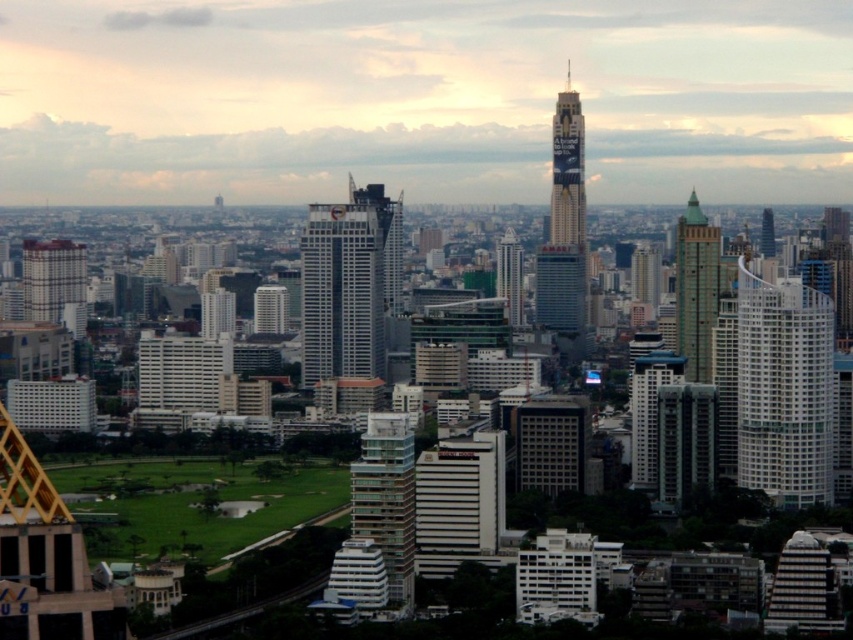
Question: Which of these objects is positioned farthest from the white glass tower at center?

Choices:
 (A) green glass skyscraper at center
 (B) blue glass building at center
 (C) white glass building at right
 (D) white glass skyscraper at center

Answer: (C)

Question: Can you confirm if metallic glass skyscraper at center is wider than matte glass skyscraper at left?

Choices:
 (A) yes
 (B) no

Answer: (B)

Question: Does white glass building at right appear over green glass skyscraper at center?

Choices:
 (A) yes
 (B) no

Answer: (B)

Question: Which object is positioned farthest from the white glass tower at center?

Choices:
 (A) matte glass skyscraper at left
 (B) metallic glass skyscraper at center
 (C) green glass tower at right

Answer: (A)

Question: Does white glass skyscraper at center appear under blue glass building at center?

Choices:
 (A) yes
 (B) no

Answer: (B)

Question: Among these objects, which one is farthest from the camera?

Choices:
 (A) green glass skyscraper at center
 (B) white glass tower at center
 (C) metallic glass skyscraper at center

Answer: (C)